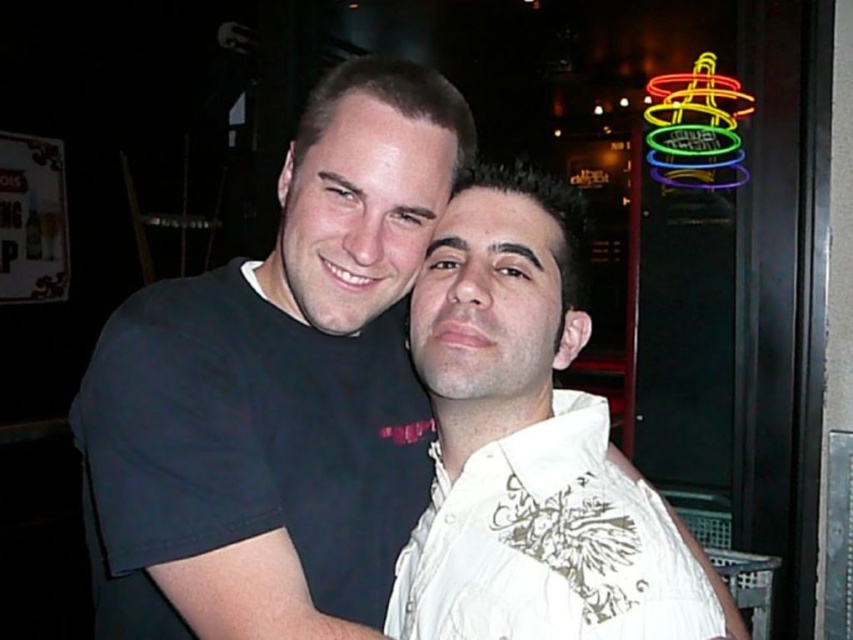
Question: Where is black matte t-shirt at center located in relation to white embroidered shirt at center in the image?

Choices:
 (A) above
 (B) below

Answer: (A)

Question: Among these points, which one is farthest from the camera?

Choices:
 (A) (403, 257)
 (B) (598, 534)
 (C) (730, 115)
 (D) (500, 589)

Answer: (C)

Question: Which point is closer to the camera?

Choices:
 (A) black matte t-shirt at center
 (B) neon sign at upper right
 (C) white textured shirt at center
 (D) white embroidered shirt at center

Answer: (D)

Question: Which object appears closest to the camera in this image?

Choices:
 (A) neon sign at upper right
 (B) white textured shirt at center
 (C) white embroidered shirt at center
 (D) black matte t-shirt at center

Answer: (C)

Question: Is white textured shirt at center above neon sign at upper right?

Choices:
 (A) yes
 (B) no

Answer: (B)

Question: Does white embroidered shirt at center appear on the right side of neon sign at upper right?

Choices:
 (A) no
 (B) yes

Answer: (A)